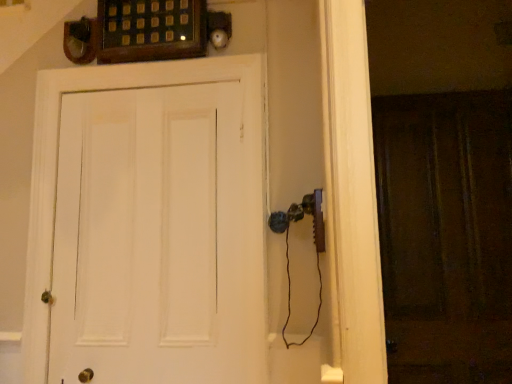
Measure the distance between point (78, 86) and camera.

Point (78, 86) and camera are 1.88 meters apart.

Image resolution: width=512 pixels, height=384 pixels. In order to click on white matte door at center in this screenshot , I will do tap(148, 224).

The image size is (512, 384). Describe the element at coordinates (148, 224) in the screenshot. I see `white matte door at center` at that location.

Image resolution: width=512 pixels, height=384 pixels. Describe the element at coordinates (446, 234) in the screenshot. I see `brown wooden screen door at right` at that location.

Find the location of a particular element. The width and height of the screenshot is (512, 384). brown wooden screen door at right is located at coordinates (446, 234).

What is the approximate height of brown wooden screen door at right?

4.85 feet.

The height and width of the screenshot is (384, 512). In order to click on white matte door at center in this screenshot , I will do [x=148, y=224].

Which is more to the right, white matte door at center or brown wooden screen door at right?

brown wooden screen door at right is more to the right.

Which object is closer to the camera taking this photo, white matte door at center or brown wooden screen door at right?

white matte door at center is in front.

Is point (203, 265) in front of point (451, 190)?

Yes.

In the scene shown: From the image's perspective, is white matte door at center located beneath brown wooden screen door at right?

No, from the image's perspective, white matte door at center is not beneath brown wooden screen door at right.

From a real-world perspective, between white matte door at center and brown wooden screen door at right, who is vertically lower?

brown wooden screen door at right.

Is white matte door at center thinner than brown wooden screen door at right?

In fact, white matte door at center might be wider than brown wooden screen door at right.

Considering the sizes of objects white matte door at center and brown wooden screen door at right in the image provided, who is taller, white matte door at center or brown wooden screen door at right?

Standing taller between the two is brown wooden screen door at right.

Which of these two, white matte door at center or brown wooden screen door at right, is bigger?

white matte door at center.

Is brown wooden screen door at right completely or partially inside white matte door at center?

Actually, brown wooden screen door at right is outside white matte door at center.

Is white matte door at center next to brown wooden screen door at right and touching it?

No, white matte door at center is not in contact with brown wooden screen door at right.

Is brown wooden screen door at right at the back of white matte door at center?

white matte door at center does not have its back to brown wooden screen door at right.

How far apart are white matte door at center and brown wooden screen door at right?

white matte door at center and brown wooden screen door at right are 3.67 feet apart from each other.

I want to click on screen door that appears below the white matte door at center (from a real-world perspective), so click(446, 234).

Looking at this image, considering the positions of objects brown wooden screen door at right and white matte door at center in the image provided, who is more to the right, brown wooden screen door at right or white matte door at center?

From the viewer's perspective, brown wooden screen door at right appears more on the right side.

Is brown wooden screen door at right in front of white matte door at center?

That is False.

Between point (388, 162) and point (169, 71), which one is positioned in front?

Positioned in front is point (169, 71).

From the image's perspective, between brown wooden screen door at right and white matte door at center, which one is located above?

white matte door at center.

From a real-world perspective, is brown wooden screen door at right above or below white matte door at center?

brown wooden screen door at right is below white matte door at center.

Is brown wooden screen door at right wider or thinner than white matte door at center?

Clearly, brown wooden screen door at right has less width compared to white matte door at center.

Considering the relative sizes of brown wooden screen door at right and white matte door at center in the image provided, is brown wooden screen door at right shorter than white matte door at center?

In fact, brown wooden screen door at right may be taller than white matte door at center.

Is brown wooden screen door at right smaller than white matte door at center?

Correct, brown wooden screen door at right occupies less space than white matte door at center.

Would you say brown wooden screen door at right is outside white matte door at center?

Absolutely, brown wooden screen door at right is external to white matte door at center.

Is brown wooden screen door at right beside white matte door at center?

No, brown wooden screen door at right is not touching white matte door at center.

From the picture: Is brown wooden screen door at right facing towards white matte door at center?

No, brown wooden screen door at right does not turn towards white matte door at center.

How different are the orientations of brown wooden screen door at right and white matte door at center in degrees?

They differ by 1.29 degrees in their facing directions.

The width and height of the screenshot is (512, 384). In order to click on screen door to the right of white matte door at center in this screenshot , I will do `click(446, 234)`.

Locate an element on the screen. door in front of the brown wooden screen door at right is located at coordinates (148, 224).

Locate an element on the screen. This screenshot has height=384, width=512. screen door that is under the white matte door at center (from a real-world perspective) is located at coordinates (446, 234).